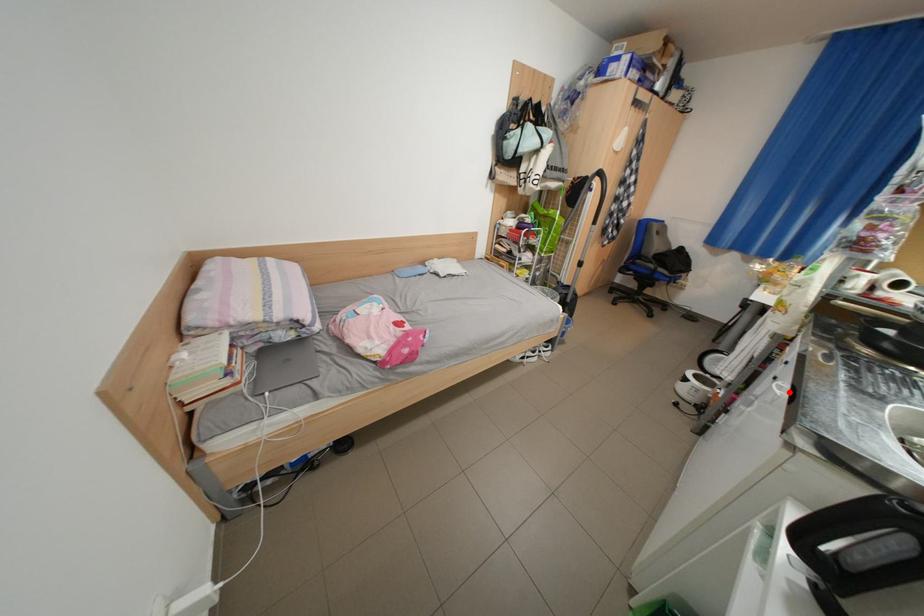
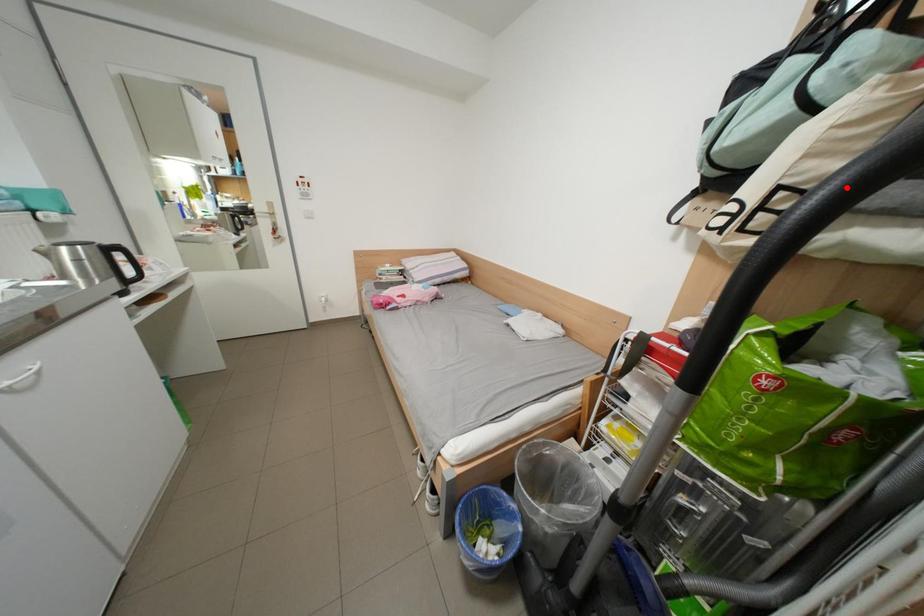
I am providing you with two images of the same scene from different viewpoints. A red point is marked on the first image and another point is marked on the second image. Is the marked point in image1 the same physical position as the marked point in image2?

No